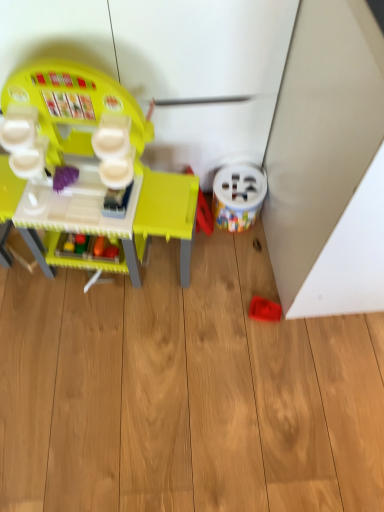
At what (x,y) coordinates should I click in order to perform the action: click on blank area to the left of rubberized red toy at lower right, the 3th toy from the left. Please return your answer as a coordinate pair (x, y). The width and height of the screenshot is (384, 512). Looking at the image, I should click on (219, 310).